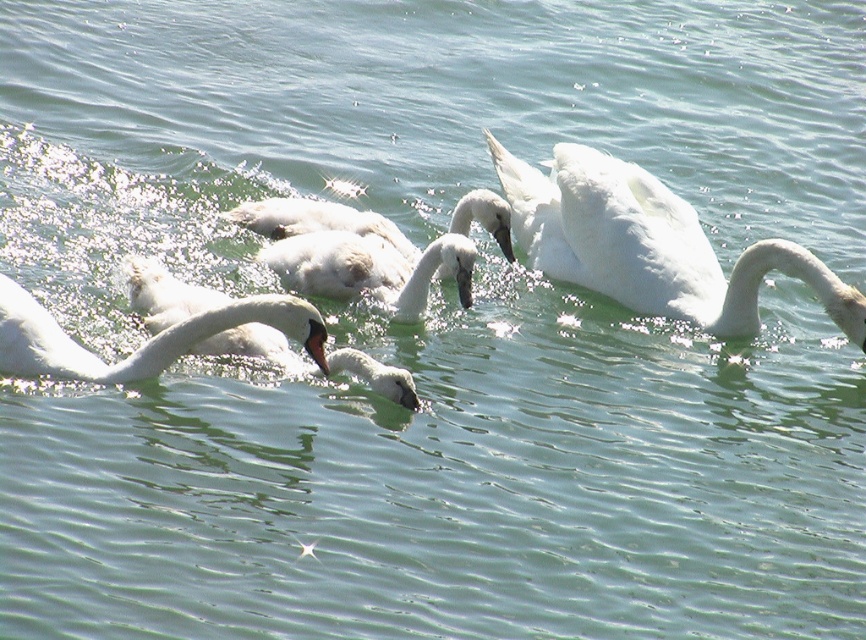
You are standing on the edge of the water and see the point marked at coordinates (369, 268). What is located at that point?

A white fluffy swan at center is located at point (369, 268).

You are observing a group of birds in the water. You notice a white feathered swan at center and a white matte duck at center. Which one is positioned more to the left?

The white feathered swan at center is positioned more to the left than the white matte duck at center.

You are standing on the edge of the water and see the white fluffy swan at center. If you want to throw a small bread piece to it, where should you aim? Please provide the coordinates in the format of x,y between 0 and 1.

You should aim at the coordinates (369, 268) where the white fluffy swan at center is located.